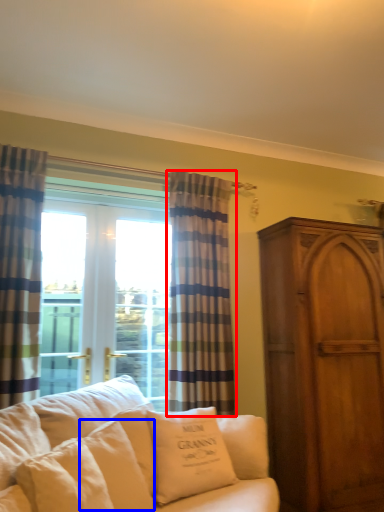
Question: Which point is closer to the camera, curtain (highlighted by a red box) or pillow (highlighted by a blue box)?

Choices:
 (A) curtain
 (B) pillow

Answer: (B)